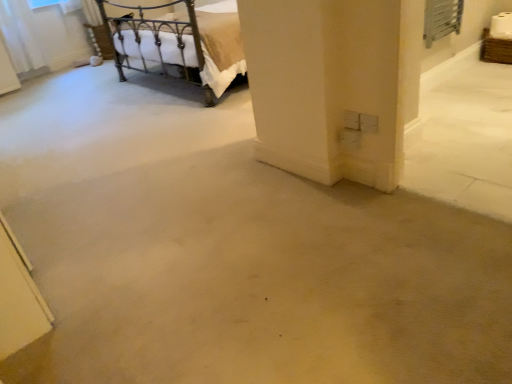
Describe the element at coordinates (178, 42) in the screenshot. I see `metallic wrought iron bed at upper left` at that location.

Find the location of `metallic wrought iron bed at upper left`. metallic wrought iron bed at upper left is located at coordinates (178, 42).

In order to click on metallic wrought iron bed at upper left in this screenshot , I will do `click(178, 42)`.